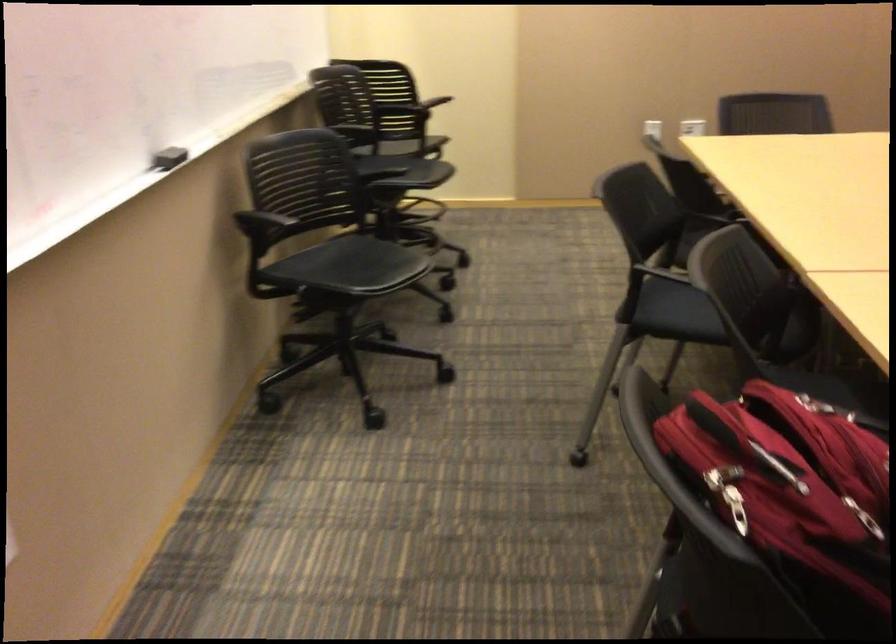
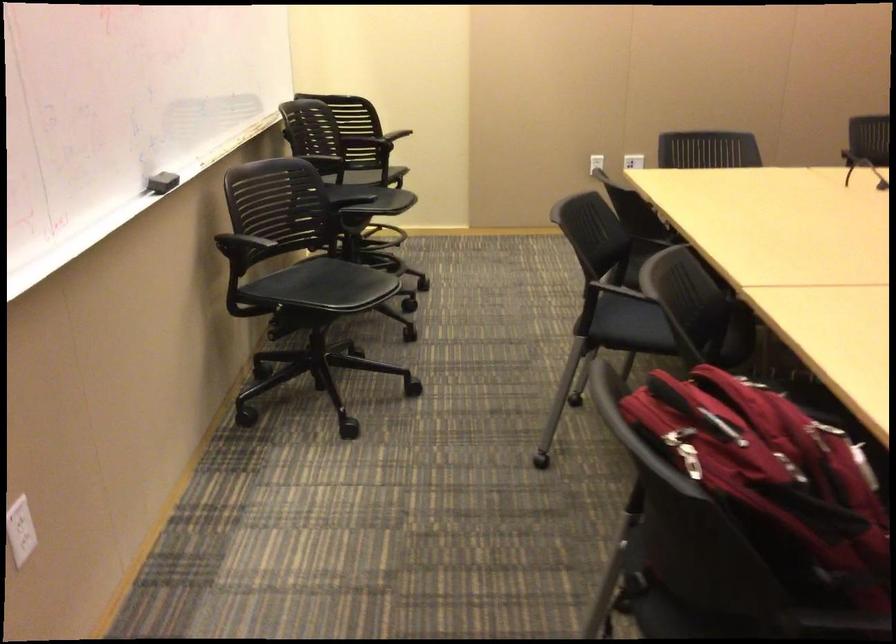
Where in the second image is the point corresponding to the point at 707,489 from the first image?

(690, 460)